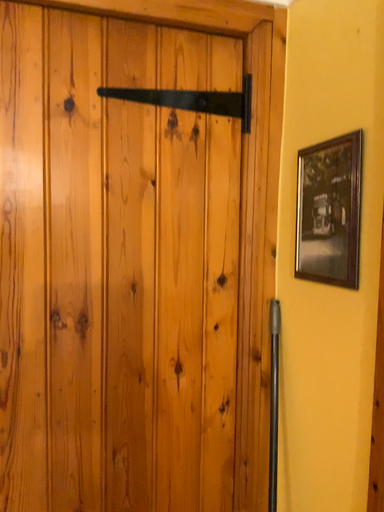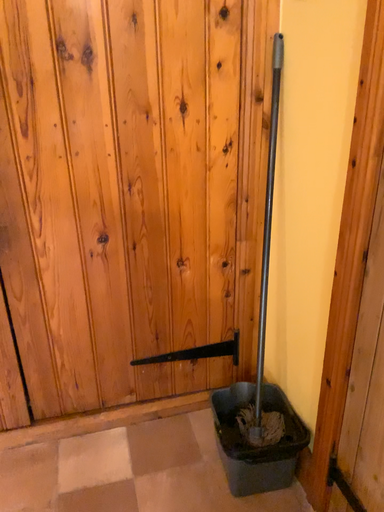
Question: How did the camera likely rotate when shooting the video?

Choices:
 (A) rotated downward
 (B) rotated upward

Answer: (A)